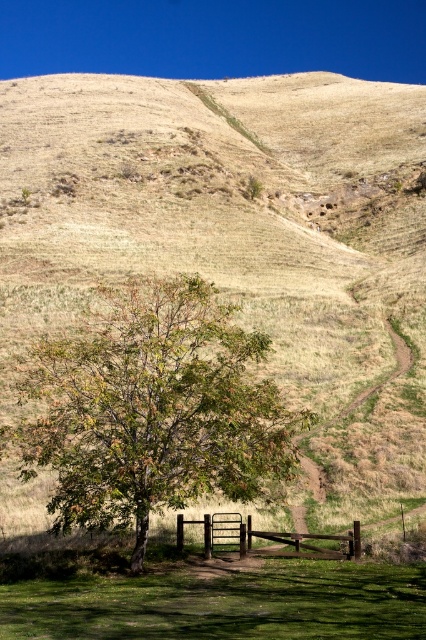
Question: Is green leafy tree at center wider than brown wooden fence at lower center?

Choices:
 (A) yes
 (B) no

Answer: (A)

Question: Which object is closer to the camera taking this photo?

Choices:
 (A) green grassy at lower center
 (B) brown wooden fence at lower center
 (C) green leafy tree at center

Answer: (A)

Question: Can you confirm if green grassy at lower center is positioned above brown wooden fence at lower center?

Choices:
 (A) no
 (B) yes

Answer: (B)

Question: Which object is closer to the camera taking this photo?

Choices:
 (A) brown wooden fence at lower center
 (B) green leafy tree at center
 (C) green grassy at lower center

Answer: (C)

Question: Which point is closer to the camera?

Choices:
 (A) (362, 582)
 (B) (351, 541)
 (C) (247, 353)

Answer: (A)

Question: Does green leafy tree at center have a smaller size compared to green grassy at lower center?

Choices:
 (A) yes
 (B) no

Answer: (B)